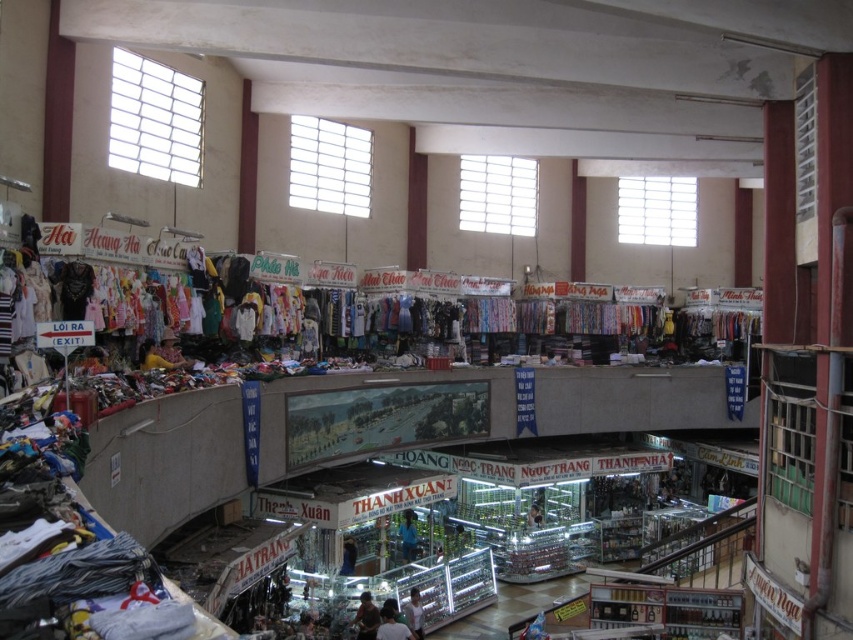
Question: Considering the relative positions of dark blue fabric at center and light brown leather jacket at center in the image provided, where is dark blue fabric at center located with respect to light brown leather jacket at center?

Choices:
 (A) below
 (B) above

Answer: (B)

Question: Among these objects, which one is farthest from the camera?

Choices:
 (A) light brown leather jacket at center
 (B) white fabric person at center
 (C) light brown fabric shirt at lower center

Answer: (A)

Question: Can you confirm if light brown fabric shirt at lower center is positioned below white fabric person at center?

Choices:
 (A) yes
 (B) no

Answer: (B)

Question: Can you confirm if white fabric person at center is bigger than light brown leather jacket at center?

Choices:
 (A) no
 (B) yes

Answer: (B)

Question: Estimate the real-world distances between objects in this image. Which object is closer to the dark blue fabric at center?

Choices:
 (A) light brown fabric shirt at lower center
 (B) light brown leather jacket at center

Answer: (A)

Question: Which object is farther from the camera taking this photo?

Choices:
 (A) white fabric person at center
 (B) light brown fabric shirt at lower center
 (C) blue fabric shirt at center

Answer: (C)